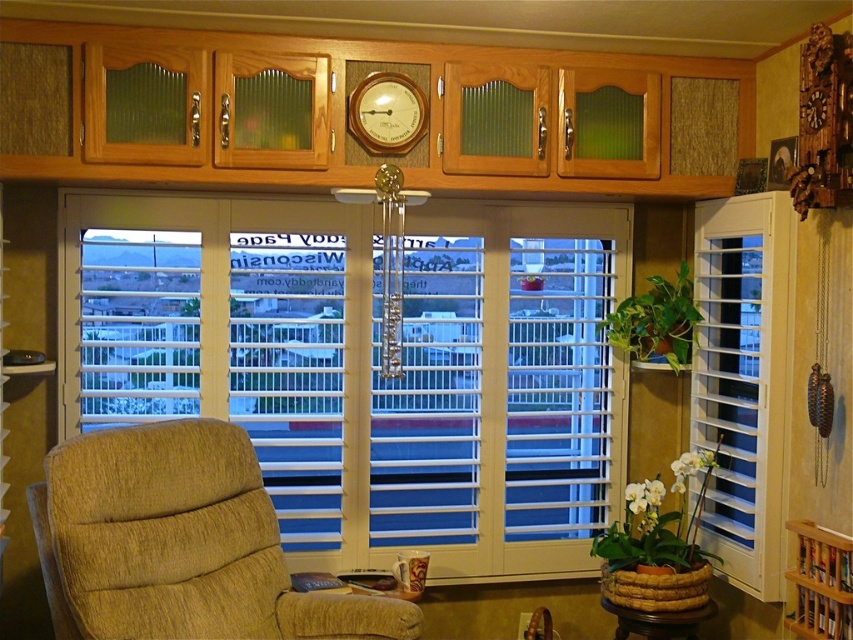
You are planning to place a beige fabric armchair at lower left next to the white wood blinds at center. Based on their sizes, will the armchair fit comfortably without touching the blinds?

The white wood blinds at center are wider than the beige fabric armchair at lower left. Since the blinds are wider, there should be enough space for the armchair to fit comfortably without touching the blinds.

Looking at this image, you are an interior designer planning to install a new wall art piece between the white wood blinds at center and the wooden clock at upper center. The wall art requires a minimum of 24 inches of space. Can the available space accommodate the artwork?

The white wood blinds at center and wooden clock at upper center are 30.79 inches apart, which is more than the required 24 inches. Therefore, the available space can accommodate the wall art piece.

You are standing in the living room and want to know what is located at the coordinates point (744, 380). What object is at that point?

The white wood shutter at right is located at point (744, 380).